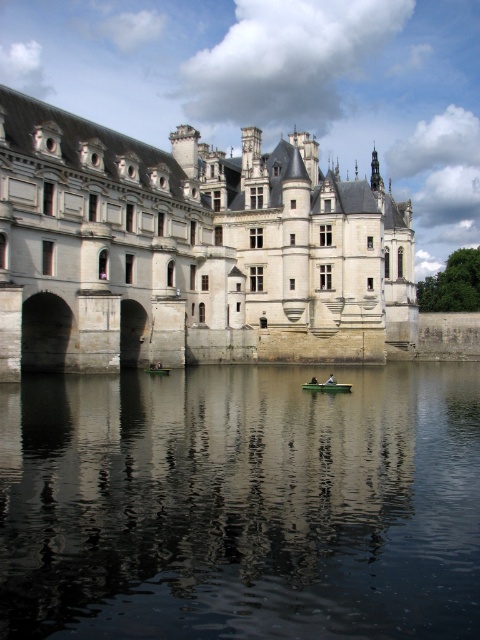
Looking at this image, you are planning to row the green plastic boat at center to the dock located at the edge of the dark reflective water at center. Given that the boat can carry a maximum weight of 250 kg and the distance between them is 21.92 meters, what is the minimum number of trips required to transport 500 kg of cargo if each trip can only carry up to the boat capacity?

The boat can carry 250 kg per trip. To transport 500 kg of cargo, you would need at least 2 trips. However, since the boat must return to the starting point after each trip except the last one, the total number of trips required would be 2 one way trips plus 1 return trip, totaling 3 trips. But since the question specifies trips to the dock, only the one way trips count, so the minimum number of trips required is 2.

You are a visitor standing on the castle grounds and want to take a photo of the dark reflective water at center and the green plastic boat at center. Which object appears larger in the photo?

The dark reflective water at center appears larger in the photo because it is taller than the green plastic boat at center.

You are a visitor standing on the castle walkway overlooking the water. You see two boats at the center of the water, a green plastic boat at center and a green fabric boat at center. Which boat appears closer to you?

The green plastic boat at center appears closer because it is in front of the green fabric boat at center from your vantage point on the walkway.